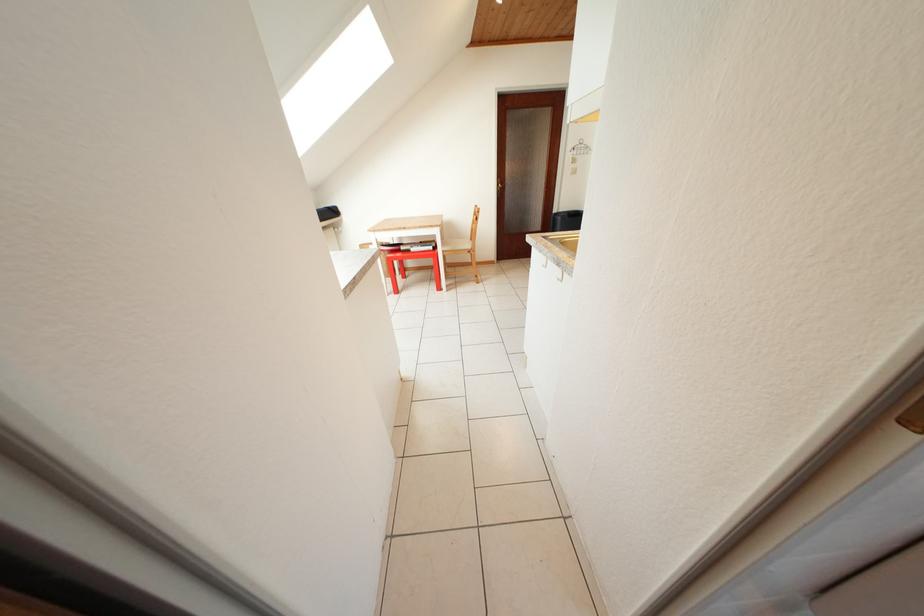
What do you see at coordinates (456, 246) in the screenshot? I see `a chair sitting surface` at bounding box center [456, 246].